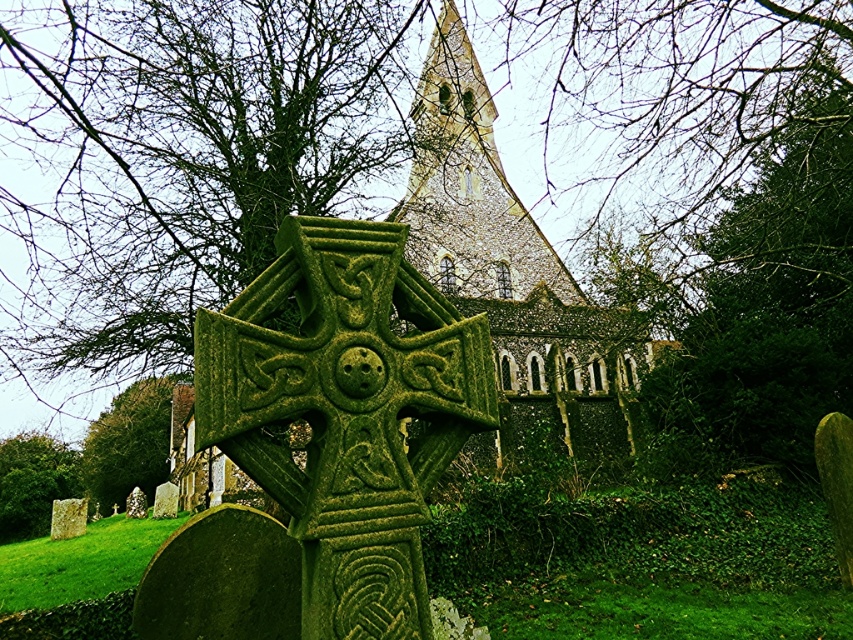
Who is taller, green mossy stone cross at center or green mossy tree at lower left?

Standing taller between the two is green mossy stone cross at center.

Is green mossy stone cross at center wider than green mossy tree at lower left?

Correct, the width of green mossy stone cross at center exceeds that of green mossy tree at lower left.

Is point (305, 406) farther from camera compared to point (136, 435)?

No, (305, 406) is closer to viewer.

Where is `green mossy stone cross at center`? This screenshot has height=640, width=853. green mossy stone cross at center is located at coordinates (346, 412).

Which is more to the left, green mossy stone cross at center or green mossy gravestone at lower left?

green mossy gravestone at lower left

Measure the distance between green mossy stone cross at center and green mossy gravestone at lower left.

They are 24.02 meters apart.

At what (x,y) coordinates should I click in order to perform the action: click on green mossy stone cross at center. Please return your answer as a coordinate pair (x, y). Looking at the image, I should click on [346, 412].

You are a GUI agent. You are given a task and a screenshot of the screen. Output one action in this format:
    pyautogui.click(x=<x>, y=<y>)
    Task: Click on the green mossy stone cross at center
    Image resolution: width=853 pixels, height=640 pixels.
    Given the screenshot: What is the action you would take?
    pyautogui.click(x=346, y=412)

Can you confirm if green mossy tree at lower left is taller than green mossy gravestone at lower left?

Yes, green mossy tree at lower left is taller than green mossy gravestone at lower left.

Which of these two, green mossy tree at lower left or green mossy gravestone at lower left, stands taller?

green mossy tree at lower left is taller.

Locate an element on the screen. Image resolution: width=853 pixels, height=640 pixels. green mossy tree at lower left is located at coordinates (129, 444).

This screenshot has width=853, height=640. In order to click on green mossy tree at lower left in this screenshot , I will do `click(129, 444)`.